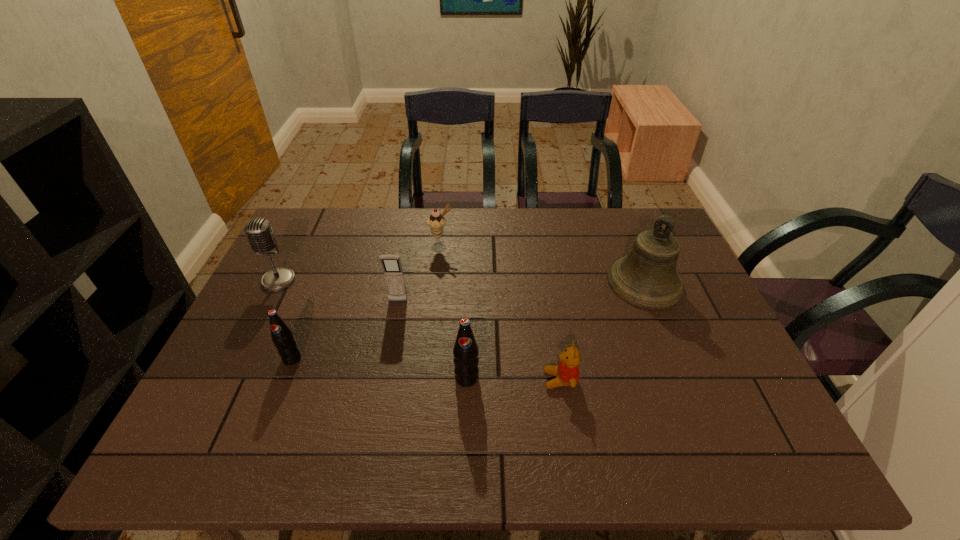
At what (x,y) coordinates should I click in order to perform the action: click on teddy bear. Please return your answer as a coordinate pair (x, y). The image size is (960, 540). Looking at the image, I should click on (567, 372).

The image size is (960, 540). I want to click on vacant space located on the front label of the sixth object from right to left, so click(x=281, y=387).

What are the coordinates of `free space located on the right of the icecream` in the screenshot? It's located at (488, 247).

Find the location of a particular element. This screenshot has width=960, height=540. free location located 0.060m on the back of the rightmost object is located at coordinates (630, 247).

Find the location of a particular element. The image size is (960, 540). free space located on the front-facing side of the cellular telephone is located at coordinates (388, 354).

Identify the location of blank space located on the back of the leftmost object. The height and width of the screenshot is (540, 960). (315, 208).

The image size is (960, 540). Find the location of `free space located on the front-facing side of the shortest object`. free space located on the front-facing side of the shortest object is located at coordinates (442, 380).

Locate an element on the screen. The height and width of the screenshot is (540, 960). free space located on the front-facing side of the shortest object is located at coordinates (428, 380).

I want to click on free space located on the front-facing side of the shortest object, so click(484, 380).

Find the location of a particular element. object located at the far edge is located at coordinates (436, 222).